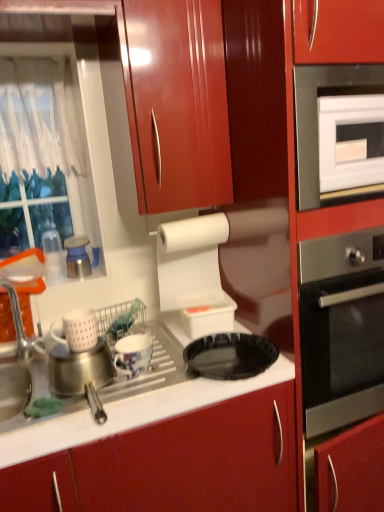
Question: Can you confirm if metallic blue and white kettle at left, which is the 4th appliance from right to left, is shorter than white glossy oven at upper right?

Choices:
 (A) no
 (B) yes

Answer: (B)

Question: Considering the relative sizes of metallic blue and white kettle at left, which is the 2th appliance from left to right, and white glossy oven at upper right in the image provided, is metallic blue and white kettle at left, which is the 2th appliance from left to right, taller than white glossy oven at upper right?

Choices:
 (A) yes
 (B) no

Answer: (B)

Question: Is metallic blue and white kettle at left, which is the 2th appliance from left to right, further to camera compared to white glossy oven at upper right?

Choices:
 (A) yes
 (B) no

Answer: (A)

Question: Can you see metallic blue and white kettle at left, which is the 4th appliance from right to left, touching white glossy oven at upper right?

Choices:
 (A) yes
 (B) no

Answer: (B)

Question: From the image's perspective, is metallic blue and white kettle at left, which is the 2th appliance from left to right, below white glossy oven at upper right?

Choices:
 (A) yes
 (B) no

Answer: (A)

Question: From the image's perspective, is black glossy plate at center above or below white glossy oven at upper right?

Choices:
 (A) below
 (B) above

Answer: (A)

Question: In terms of size, does black glossy plate at center appear bigger or smaller than white glossy oven at upper right?

Choices:
 (A) big
 (B) small

Answer: (B)

Question: Relative to white glossy oven at upper right, is black glossy plate at center in front or behind?

Choices:
 (A) front
 (B) behind

Answer: (A)

Question: Is black glossy plate at center taller or shorter than white glossy oven at upper right?

Choices:
 (A) tall
 (B) short

Answer: (B)

Question: From their relative heights in the image, would you say green sponge at sink is taller or shorter than white plastic container at upper center, the first appliance positioned from the right?

Choices:
 (A) short
 (B) tall

Answer: (A)

Question: Looking at their shapes, would you say green sponge at sink is wider or thinner than white plastic container at upper center, which is the fifth appliance in left-to-right order?

Choices:
 (A) wide
 (B) thin

Answer: (B)

Question: Based on their sizes in the image, would you say green sponge at sink is bigger or smaller than white plastic container at upper center, which is the fifth appliance in left-to-right order?

Choices:
 (A) small
 (B) big

Answer: (A)

Question: Would you say green sponge at sink is to the left or to the right of white plastic container at upper center, the first appliance positioned from the right, in the picture?

Choices:
 (A) right
 (B) left

Answer: (B)

Question: Considering the positions of clear plastic cups at left, marked as the 1th appliance in a left-to-right arrangement, and white plastic container at upper center, the first appliance positioned from the right, in the image, is clear plastic cups at left, marked as the 1th appliance in a left-to-right arrangement, taller or shorter than white plastic container at upper center, the first appliance positioned from the right,?

Choices:
 (A) tall
 (B) short

Answer: (A)

Question: From a real-world perspective, is clear plastic cups at left, marked as the 1th appliance in a left-to-right arrangement, physically located above or below white plastic container at upper center, the first appliance positioned from the right?

Choices:
 (A) above
 (B) below

Answer: (A)